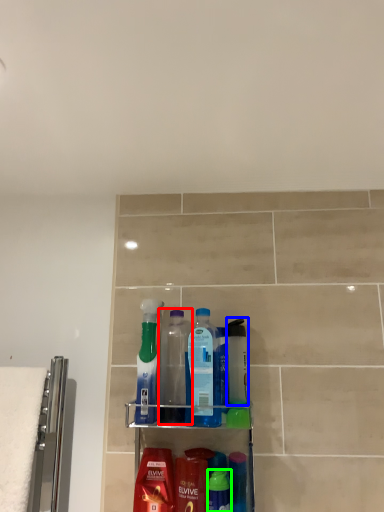
Question: Estimate the real-world distances between objects in this image. Which object is closer to bottle (highlighted by a red box), mouthwash (highlighted by a blue box) or mouthwash (highlighted by a green box)?

Choices:
 (A) mouthwash
 (B) mouthwash

Answer: (A)